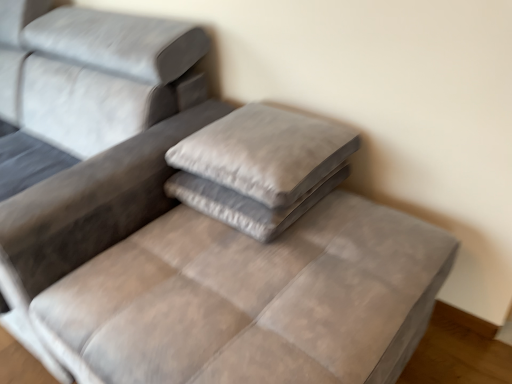
Question: From a real-world perspective, is velvet gray pillow at center, which appears as the first pillow when ordered from the bottom, positioned above or below velvet gray mattress at center?

Choices:
 (A) above
 (B) below

Answer: (A)

Question: Does point 262,223 appear closer or farther from the camera than point 211,317?

Choices:
 (A) farther
 (B) closer

Answer: (A)

Question: Which is farther from the velvet gray pillow at center, the 2th pillow viewed from the top?

Choices:
 (A) velvet gray mattress at center
 (B) suede gray pillow at center, placed as the second pillow when sorted from bottom to top

Answer: (A)

Question: Which of these objects is positioned farthest from the suede gray pillow at center, placed as the second pillow when sorted from bottom to top?

Choices:
 (A) velvet gray mattress at center
 (B) velvet gray pillow at center, which appears as the first pillow when ordered from the bottom

Answer: (A)